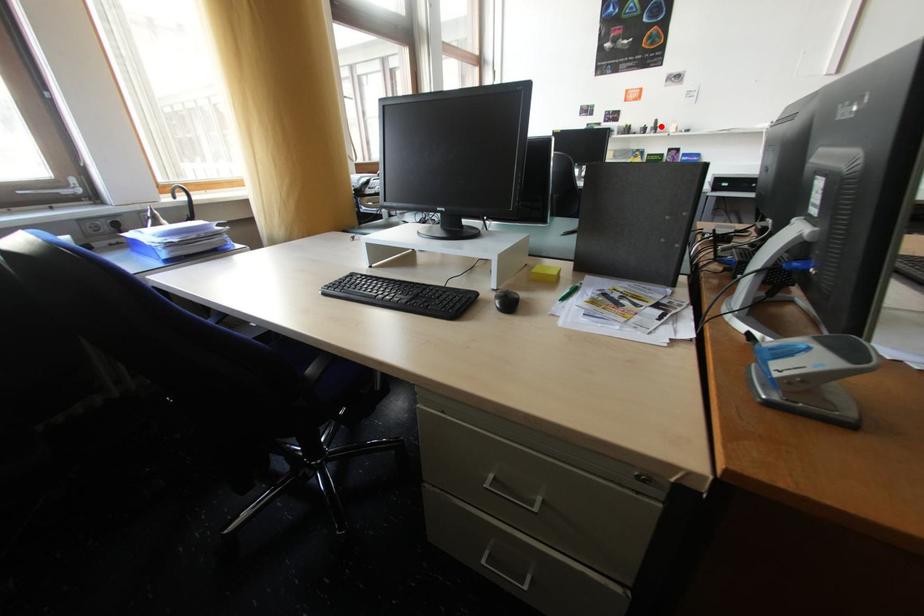
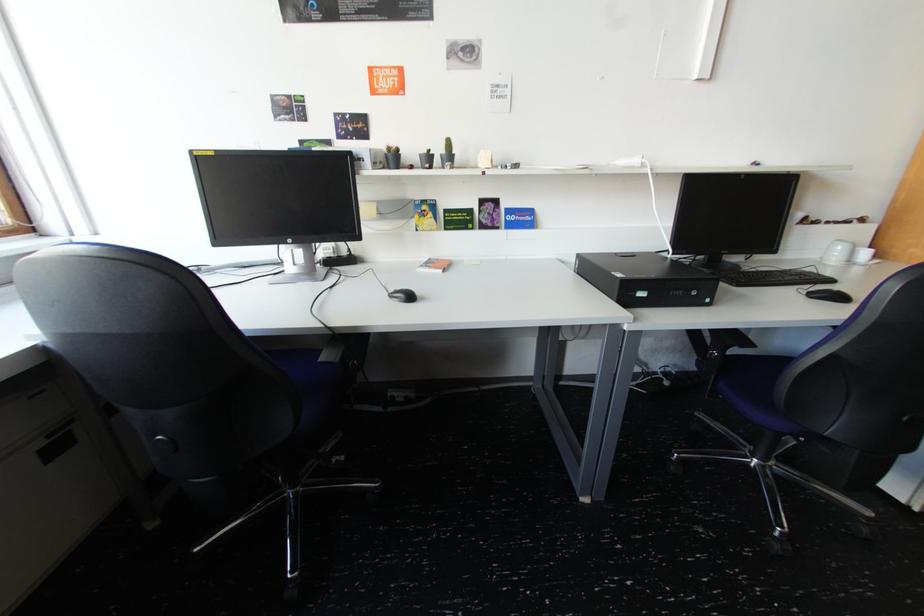
The point at the highlighted location is marked in the first image. Where is the corresponding point in the second image?

(452, 152)